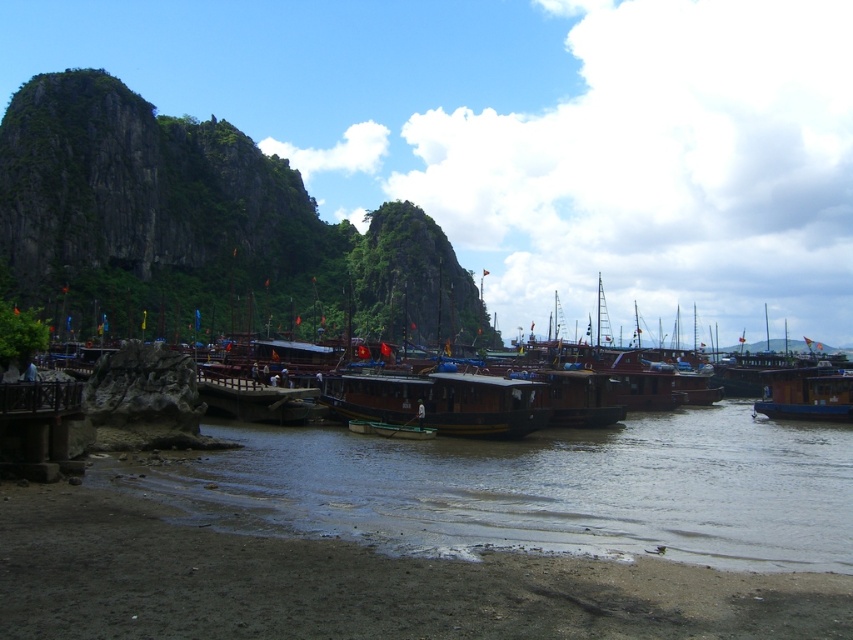
Does brown wooden boat at right have a greater height compared to green wooden boat at center?

Yes.

Who is shorter, brown wooden boat at right or green wooden boat at center?

With less height is green wooden boat at center.

Which is behind, point (788, 372) or point (380, 422)?

The point (788, 372) is behind.

Image resolution: width=853 pixels, height=640 pixels. I want to click on brown wooden boat at right, so click(805, 394).

Is point (370, 381) closer to camera compared to point (822, 396)?

That is True.

Is brown wooden boat at center thinner than brown wooden boat at right?

Incorrect, brown wooden boat at center's width is not less than brown wooden boat at right's.

Which is in front, point (453, 433) or point (798, 417)?

Point (453, 433) is in front.

Locate an element on the screen. The height and width of the screenshot is (640, 853). brown wooden boat at center is located at coordinates [440, 403].

From the picture: Is the position of brown wooden boat at center less distant than that of green wooden boat at center?

That is True.

Who is lower down, brown wooden boat at center or green wooden boat at center?

green wooden boat at center is below.

Is point (523, 435) behind point (368, 428)?

No.

Identify the location of brown wooden boat at center. click(x=440, y=403).